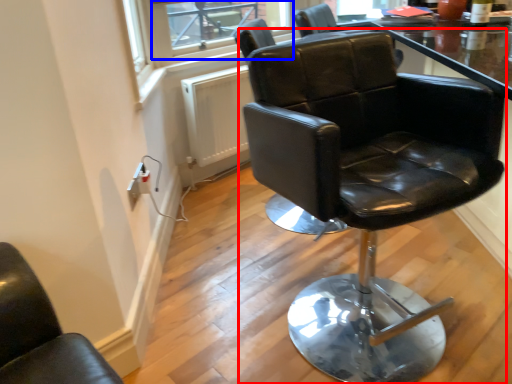
Question: Among these objects, which one is nearest to the camera, chair (highlighted by a red box) or window screen (highlighted by a blue box)?

Choices:
 (A) chair
 (B) window screen

Answer: (A)